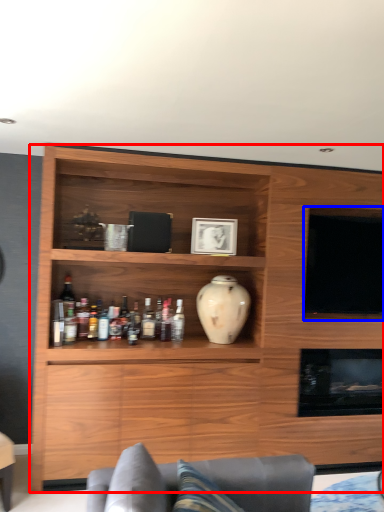
Question: Which object appears closest to the camera in this image, cabinetry (highlighted by a red box) or television (highlighted by a blue box)?

Choices:
 (A) cabinetry
 (B) television

Answer: (A)